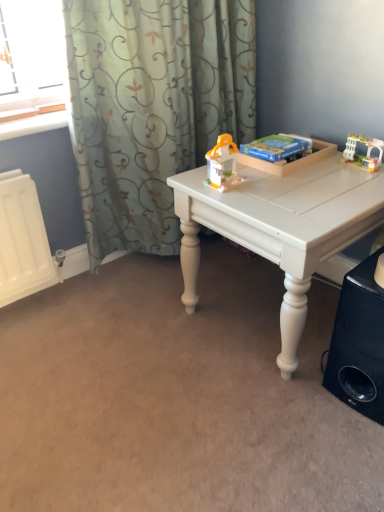
Where is `free space to the left of white plastic toy at upper right, the first toy when ordered from right to left`? This screenshot has height=512, width=384. free space to the left of white plastic toy at upper right, the first toy when ordered from right to left is located at coordinates (320, 172).